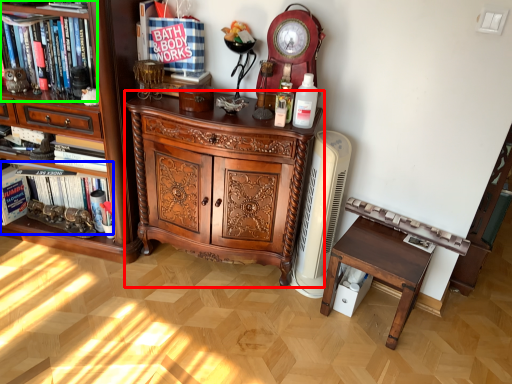
Question: Based on their relative distances, which object is farther from chest of drawers (highlighted by a red box)? Choose from book (highlighted by a blue box) and shelf (highlighted by a green box).

Choices:
 (A) book
 (B) shelf

Answer: (B)